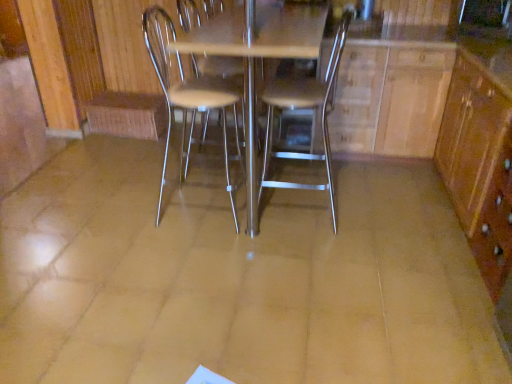
This screenshot has height=384, width=512. Identify the location of vacant space situated on the left part of metallic silver chair at center, the first chair when ordered from left to right. (132, 215).